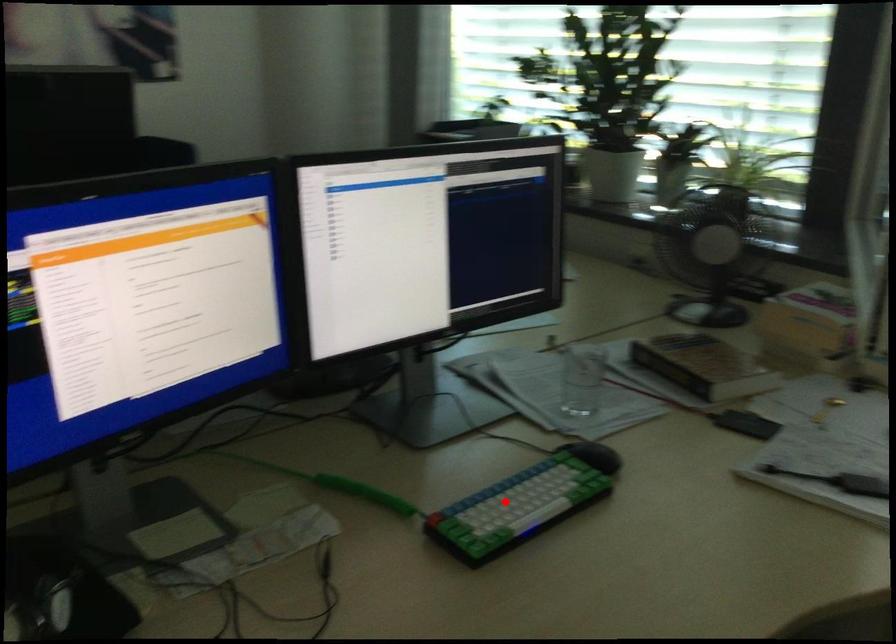
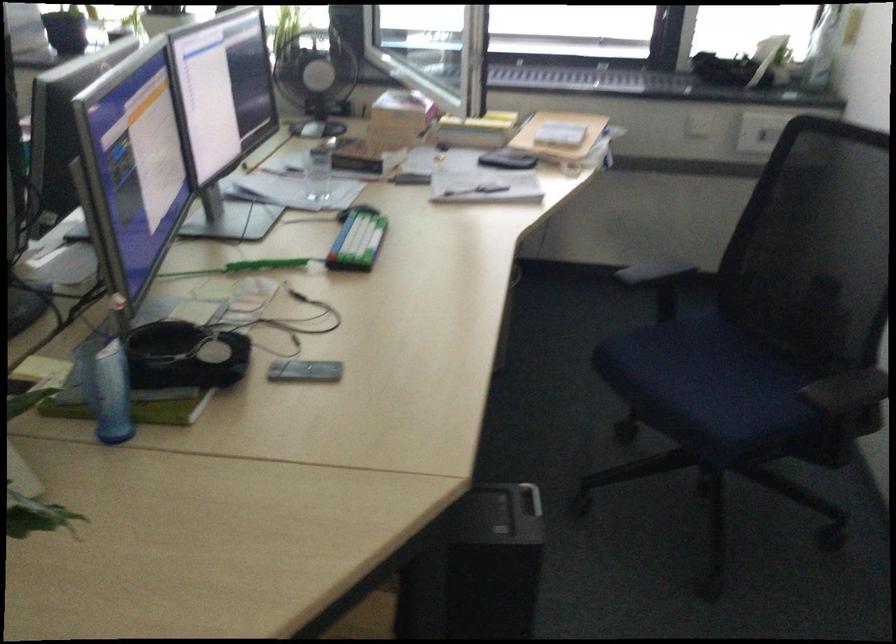
Locate, in the second image, the point that corresponds to the highlighted location in the first image.

(357, 240)